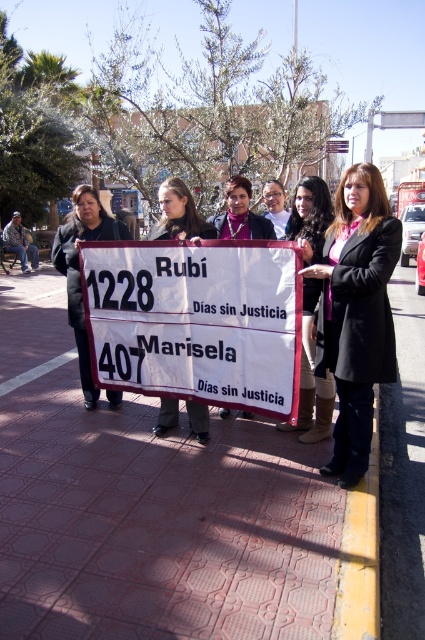
Question: Does matte black coat at center have a smaller size compared to matte black sign at center?

Choices:
 (A) no
 (B) yes

Answer: (A)

Question: Is white paper sign at center above matte black coat at center?

Choices:
 (A) yes
 (B) no

Answer: (B)

Question: Among these points, which one is farthest from the camera?

Choices:
 (A) (133, 282)
 (B) (317, 404)
 (C) (346, 515)
 (D) (187, 236)

Answer: (B)

Question: Which point is farther to the camera?

Choices:
 (A) (215, 218)
 (B) (206, 234)
 (C) (254, 241)
 (D) (0, 365)

Answer: (D)

Question: Among these objects, which one is farthest from the camera?

Choices:
 (A) matte black coat at center
 (B) white paper sign at center

Answer: (B)

Question: In this image, where is white paper sign at center located relative to matte black coat at center?

Choices:
 (A) right
 (B) left

Answer: (B)